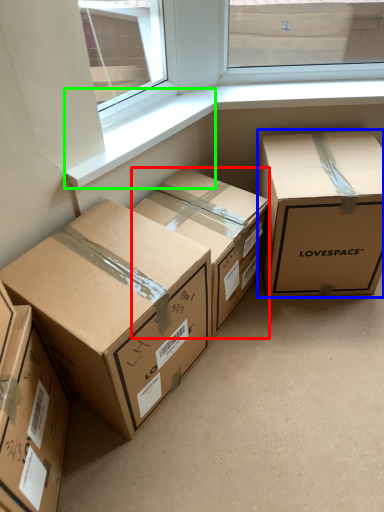
Question: Estimate the real-world distances between objects in this image. Which object is closer to box (highlighted by a red box), box (highlighted by a blue box) or window sill (highlighted by a green box)?

Choices:
 (A) box
 (B) window sill

Answer: (A)